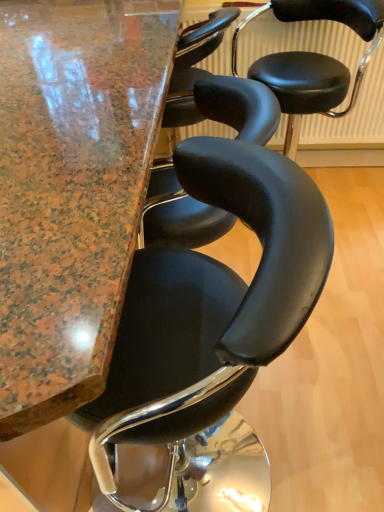
At what (x,y) coordinates should I click in order to perform the action: click on black leather stool at center, marked as the 2th chair in a front-to-back arrangement. Please return your answer as a coordinate pair (x, y). Looking at the image, I should click on (313, 60).

I want to click on black leather chair at center, which is the 1th chair in front-to-back order, so click(211, 304).

Is point (325, 71) positioned behind point (132, 206)?

Yes, it is behind point (132, 206).

Looking at this image, from a real-world perspective, does black leather stool at center, arranged as the first chair when viewed from the back, stand above marble table at center?

Yes, from a real-world perspective, black leather stool at center, arranged as the first chair when viewed from the back, is above marble table at center.

Is black leather stool at center, placed as the first chair when sorted from top to bottom, bigger or smaller than marble table at center?

black leather stool at center, placed as the first chair when sorted from top to bottom, is smaller than marble table at center.

Looking at this image, is black leather stool at center, arranged as the first chair when viewed from the back, bigger or smaller than black leather chair at center, which is the 1th chair in front-to-back order?

Considering their sizes, black leather stool at center, arranged as the first chair when viewed from the back, takes up less space than black leather chair at center, which is the 1th chair in front-to-back order.

Is black leather stool at center, arranged as the first chair when viewed from the back, at the right side of black leather chair at center, which is the second chair from top to bottom?

Indeed, black leather stool at center, arranged as the first chair when viewed from the back, is positioned on the right side of black leather chair at center, which is the second chair from top to bottom.

Does point (255, 74) come closer to viewer compared to point (138, 318)?

That is False.

Considering the sizes of objects black leather stool at center, which is counted as the 2th chair, starting from the bottom, and black leather chair at center, which is the second chair from top to bottom, in the image provided, who is shorter, black leather stool at center, which is counted as the 2th chair, starting from the bottom, or black leather chair at center, which is the second chair from top to bottom,?

black leather stool at center, which is counted as the 2th chair, starting from the bottom.

From a real-world perspective, is marble table at center physically located above or below black leather chair at center, which is the second chair from top to bottom?

marble table at center is below black leather chair at center, which is the second chair from top to bottom.

How many degrees apart are the facing directions of marble table at center and black leather chair at center, which is the second chair from top to bottom?

They differ by 1.57 degrees in their facing directions.

From the image's perspective, is marble table at center positioned above or below black leather chair at center, positioned as the second chair in back-to-front order?

From the image's perspective, marble table at center appears above black leather chair at center, positioned as the second chair in back-to-front order.

Is marble table at center taller or shorter than black leather chair at center, which is counted as the 1th chair, starting from the bottom?

In the image, marble table at center appears to be taller than black leather chair at center, which is counted as the 1th chair, starting from the bottom.

Looking at this image, are marble table at center and black leather stool at center, which is counted as the 2th chair, starting from the bottom, far apart?

No, marble table at center is in close proximity to black leather stool at center, which is counted as the 2th chair, starting from the bottom.

From a real-world perspective, which object rests below the other?

marble table at center, from a real-world perspective.

How many degrees apart are the facing directions of marble table at center and black leather stool at center, placed as the first chair when sorted from top to bottom?

There is a 88.2-degree angle between the facing directions of marble table at center and black leather stool at center, placed as the first chair when sorted from top to bottom.

From the picture: Which is more to the right, marble table at center or black leather stool at center, marked as the 2th chair in a front-to-back arrangement?

From the viewer's perspective, black leather stool at center, marked as the 2th chair in a front-to-back arrangement, appears more on the right side.

Between black leather chair at center, which is the 1th chair in front-to-back order, and marble table at center, which one has larger size?

Bigger between the two is marble table at center.

From a real-world perspective, is black leather chair at center, which is the second chair from top to bottom, on top of marble table at center?

Yes, from a real-world perspective, black leather chair at center, which is the second chair from top to bottom, is on top of marble table at center.

Considering the sizes of objects black leather chair at center, which is counted as the 1th chair, starting from the bottom, and marble table at center in the image provided, who is wider, black leather chair at center, which is counted as the 1th chair, starting from the bottom, or marble table at center?

With larger width is marble table at center.

Considering the relative positions of black leather chair at center, which is the 1th chair in front-to-back order, and marble table at center in the image provided, is black leather chair at center, which is the 1th chair in front-to-back order, to the left or to the right of marble table at center?

From the image, it's evident that black leather chair at center, which is the 1th chair in front-to-back order, is to the right of marble table at center.

Based on the photo, is the surface of black leather chair at center, which is counted as the 1th chair, starting from the bottom, in direct contact with black leather stool at center, which is counted as the 2th chair, starting from the bottom?

No, black leather chair at center, which is counted as the 1th chair, starting from the bottom, is not beside black leather stool at center, which is counted as the 2th chair, starting from the bottom.

Can you confirm if black leather chair at center, which is the second chair from top to bottom, is bigger than black leather stool at center, which is counted as the 2th chair, starting from the bottom?

Yes, black leather chair at center, which is the second chair from top to bottom, is bigger than black leather stool at center, which is counted as the 2th chair, starting from the bottom.

Considering the relative sizes of black leather chair at center, which is the 1th chair in front-to-back order, and black leather stool at center, which is counted as the 2th chair, starting from the bottom, in the image provided, is black leather chair at center, which is the 1th chair in front-to-back order, taller than black leather stool at center, which is counted as the 2th chair, starting from the bottom,?

Yes, black leather chair at center, which is the 1th chair in front-to-back order, is taller than black leather stool at center, which is counted as the 2th chair, starting from the bottom.

Is black leather chair at center, which is counted as the 1th chair, starting from the bottom, positioned with its back to black leather stool at center, marked as the 2th chair in a front-to-back arrangement?

No, black leather chair at center, which is counted as the 1th chair, starting from the bottom, is not facing away from black leather stool at center, marked as the 2th chair in a front-to-back arrangement.

Identify the location of table that is on the left side of black leather stool at center, marked as the 2th chair in a front-to-back arrangement. This screenshot has height=512, width=384. (72, 189).

In order to click on chair behind the black leather chair at center, which is the second chair from top to bottom in this screenshot , I will do `click(313, 60)`.

Looking at the image, which one is located closer to black leather stool at center, marked as the 2th chair in a front-to-back arrangement, marble table at center or black leather chair at center, which is counted as the 1th chair, starting from the bottom?

The object closer to black leather stool at center, marked as the 2th chair in a front-to-back arrangement, is marble table at center.

When comparing their distances from black leather chair at center, positioned as the second chair in back-to-front order, does black leather stool at center, which is counted as the 2th chair, starting from the bottom, or marble table at center seem further?

The object further to black leather chair at center, positioned as the second chair in back-to-front order, is black leather stool at center, which is counted as the 2th chair, starting from the bottom.

Estimate the real-world distances between objects in this image. Which object is further from black leather stool at center, marked as the 2th chair in a front-to-back arrangement, black leather chair at center, which is counted as the 1th chair, starting from the bottom, or marble table at center?

Based on the image, black leather chair at center, which is counted as the 1th chair, starting from the bottom, appears to be further to black leather stool at center, marked as the 2th chair in a front-to-back arrangement.

From the image, which object appears to be farther from black leather chair at center, which is the second chair from top to bottom, marble table at center or black leather stool at center, marked as the 2th chair in a front-to-back arrangement?

black leather stool at center, marked as the 2th chair in a front-to-back arrangement, lies further to black leather chair at center, which is the second chair from top to bottom, than the other object.

Looking at the image, which one is located further to marble table at center, black leather chair at center, which is the 1th chair in front-to-back order, or black leather stool at center, placed as the first chair when sorted from top to bottom?

black leather stool at center, placed as the first chair when sorted from top to bottom, lies further to marble table at center than the other object.

When comparing their distances from marble table at center, does black leather stool at center, arranged as the first chair when viewed from the back, or black leather chair at center, positioned as the second chair in back-to-front order, seem closer?

black leather chair at center, positioned as the second chair in back-to-front order.

Find the location of a particular element. chair between marble table at center and black leather stool at center, marked as the 2th chair in a front-to-back arrangement, along the z-axis is located at coordinates (211, 304).